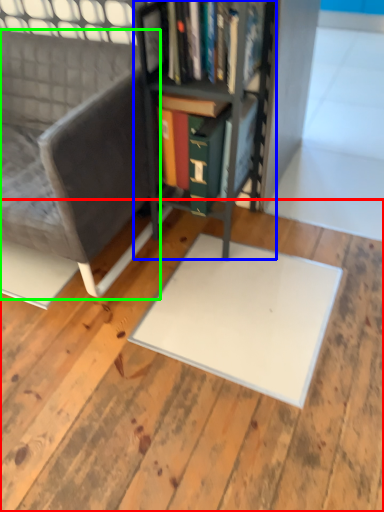
Question: Estimate the real-world distances between objects in this image. Which object is farther from plywood (highlighted by a red box), bookcase (highlighted by a blue box) or chair (highlighted by a green box)?

Choices:
 (A) bookcase
 (B) chair

Answer: (A)